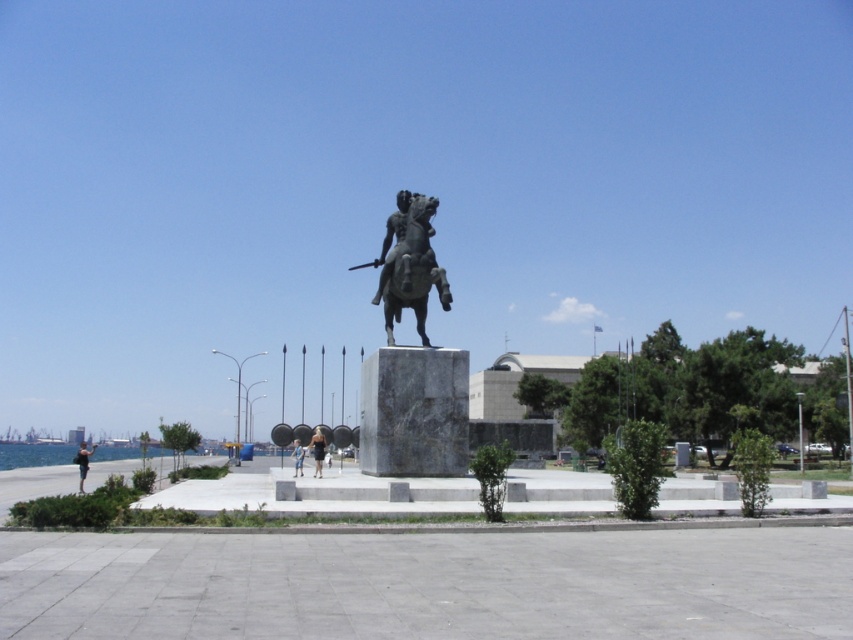
Question: Can you confirm if bronze statue at center is smaller than blue denim shorts at center?

Choices:
 (A) no
 (B) yes

Answer: (A)

Question: Is bronze statue at center further to the viewer compared to dark blue dress at center?

Choices:
 (A) no
 (B) yes

Answer: (A)

Question: Which object appears closest to the camera in this image?

Choices:
 (A) dark blue dress at center
 (B) bronze statue at center
 (C) light blue denim shorts at lower left

Answer: (B)

Question: Which of the following is the farthest from the observer?

Choices:
 (A) [x=82, y=488]
 (B) [x=381, y=250]
 (C) [x=294, y=452]
 (D) [x=322, y=460]

Answer: (C)

Question: Among these points, which one is nearest to the camera?

Choices:
 (A) (322, 460)
 (B) (408, 250)

Answer: (B)

Question: Is dark blue dress at center smaller than light blue denim shorts at lower left?

Choices:
 (A) no
 (B) yes

Answer: (B)